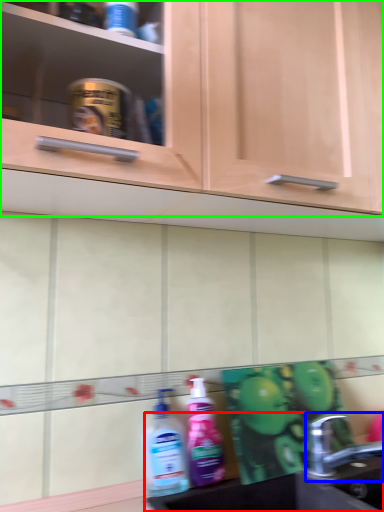
Question: Which is nearer to the sink (highlighted by a red box)? tap (highlighted by a blue box) or cabinetry (highlighted by a green box).

Choices:
 (A) tap
 (B) cabinetry

Answer: (A)